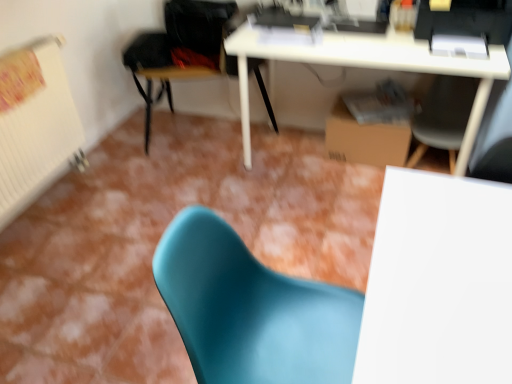
Identify the location of blank space situated above white glossy desk at upper center (from a real-world perspective). Image resolution: width=512 pixels, height=384 pixels. (357, 41).